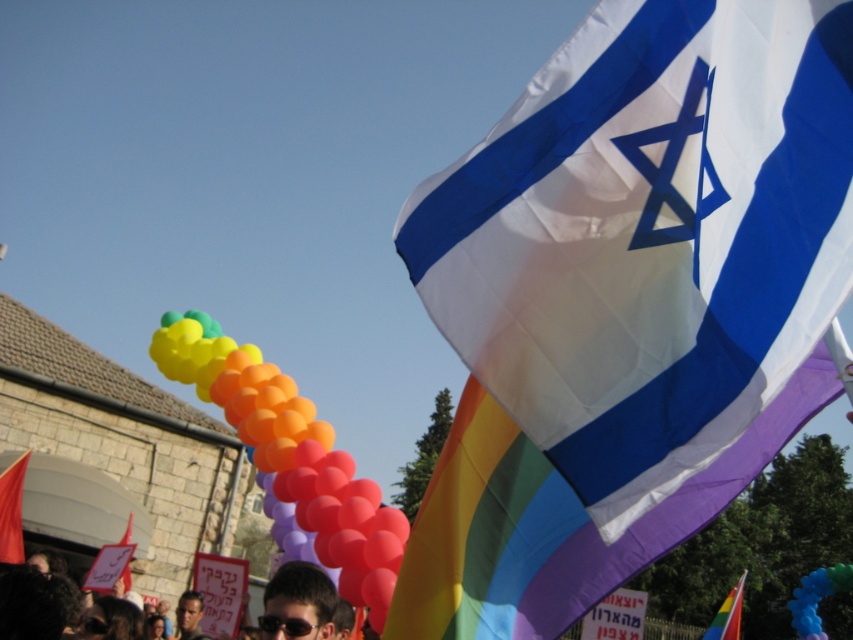
Question: Considering the relative positions of white silk flag at upper right and rainbow glossy balloons at center in the image provided, where is white silk flag at upper right located with respect to rainbow glossy balloons at center?

Choices:
 (A) above
 (B) below

Answer: (A)

Question: Is rainbow fabric flag at upper right further to camera compared to rainbow glossy balloons at center?

Choices:
 (A) no
 (B) yes

Answer: (A)

Question: Which object is farther from the camera taking this photo?

Choices:
 (A) matte black sunglasses at center
 (B) rainbow fabric flag at upper center
 (C) rainbow glossy balloons at center
 (D) rainbow fabric flag at upper right

Answer: (B)

Question: Is rainbow fabric flag at upper right closer to the viewer compared to black matte sunglasses at center?

Choices:
 (A) no
 (B) yes

Answer: (B)

Question: Among these objects, which one is nearest to the camera?

Choices:
 (A) matte red flag at lower left
 (B) rainbow glossy balloons at center
 (C) black matte sunglasses at center
 (D) matte black sunglasses at center

Answer: (D)

Question: Considering the real-world distances, which object is closest to the white silk flag at upper right?

Choices:
 (A) rainbow fabric flag at upper center
 (B) rainbow glossy balloons at center
 (C) matte black sunglasses at center
 (D) black matte sunglasses at center

Answer: (C)